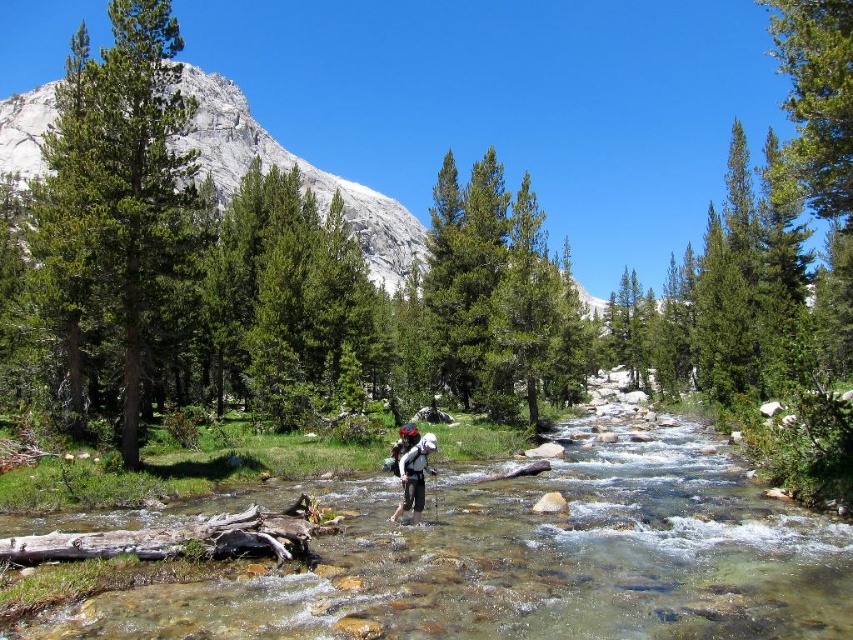
Is the position of clear glass stream at center less distant than that of white fabric backpack at center?

Yes, it is.

Is point (289, 636) farther from camera compared to point (408, 490)?

No.

Image resolution: width=853 pixels, height=640 pixels. What do you see at coordinates (526, 561) in the screenshot?
I see `clear glass stream at center` at bounding box center [526, 561].

Where is `clear glass stream at center`? clear glass stream at center is located at coordinates (526, 561).

Is green matte tree at center above white fabric backpack at center?

Yes.

Who is more distant from viewer, (x=497, y=198) or (x=422, y=481)?

The point (x=497, y=198) is more distant.

Where is `green matte tree at center`? green matte tree at center is located at coordinates (496, 298).

Between green matte tree at center and gray rock mountain at upper left, which one is positioned higher?

gray rock mountain at upper left is above.

Measure the distance between point (469, 269) and camera.

The distance of point (469, 269) from camera is 94.22 meters.

At what (x,y) coordinates should I click in order to perform the action: click on green matte tree at center. Please return your answer as a coordinate pair (x, y). This screenshot has width=853, height=640. Looking at the image, I should click on (496, 298).